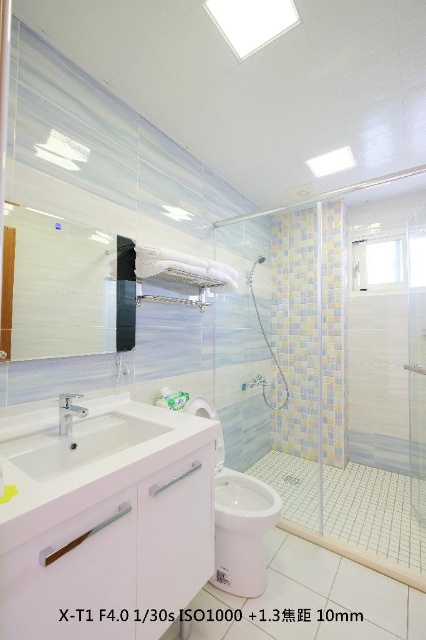
Is white glossy toilet bowl at lower center smaller than white glossy tile at lower center?

Incorrect, white glossy toilet bowl at lower center is not smaller in size than white glossy tile at lower center.

Does point (259, 486) come in front of point (275, 564)?

No, it is behind (275, 564).

Identify the location of white glossy toilet bowl at lower center. The image size is (426, 640). (241, 531).

How far apart are white glossy tile at lower center and white glossy shower head at upper center?

white glossy tile at lower center is 1.67 meters from white glossy shower head at upper center.

Can you confirm if white glossy tile at lower center is taller than white glossy shower head at upper center?

No, white glossy tile at lower center is not taller than white glossy shower head at upper center.

Which is behind, point (322, 577) or point (262, 262)?

Positioned behind is point (262, 262).

This screenshot has height=640, width=426. I want to click on white glossy tile at lower center, so click(x=302, y=561).

Is white glossy sink at lower left positioned before satin chrome faucet at lower left?

Yes, it is.

Is point (6, 435) behind point (71, 412)?

That is False.

Where is `white glossy sink at lower left`? Image resolution: width=426 pixels, height=640 pixels. white glossy sink at lower left is located at coordinates (75, 436).